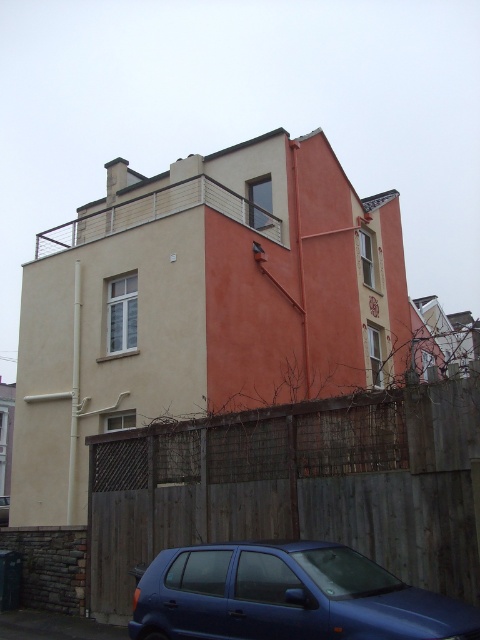
Is point (305, 410) positioned after point (3, 497)?

No, it is not.

Find the location of a particular element. wooden fence at lower center is located at coordinates (297, 484).

Can you confirm if wooden fence at lower center is wider than matte blue hatchback at lower center?

Indeed, wooden fence at lower center has a greater width compared to matte blue hatchback at lower center.

Is point (371, 426) farther from viewer compared to point (396, 600)?

That is True.

This screenshot has width=480, height=640. I want to click on wooden fence at lower center, so [297, 484].

In the scene shown: Can you confirm if matte blue hatchback at lower center is smaller than blue matte car at lower center?

Yes, matte blue hatchback at lower center is smaller than blue matte car at lower center.

Which is below, matte blue hatchback at lower center or blue matte car at lower center?

blue matte car at lower center

Who is more forward, (x=205, y=552) or (x=2, y=508)?

Positioned in front is point (x=205, y=552).

You are a GUI agent. You are given a task and a screenshot of the screen. Output one action in this format:
    pyautogui.click(x=<x>, y=<y>)
    Task: Click on the matte blue hatchback at lower center
    The height and width of the screenshot is (640, 480).
    Given the screenshot: What is the action you would take?
    pyautogui.click(x=287, y=596)